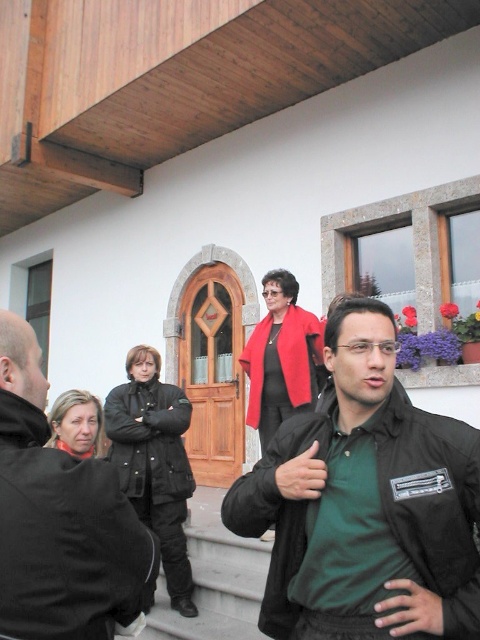
Question: Which object is closer to the camera taking this photo?

Choices:
 (A) dark green fabric jacket at lower right
 (B) matte red jacket at center
 (C) dark green textured jacket at center
 (D) black matte jacket at lower right

Answer: (A)

Question: Does black matte jacket at lower right appear over matte red jacket at center?

Choices:
 (A) yes
 (B) no

Answer: (B)

Question: Which point is closer to the camera taking this photo?

Choices:
 (A) (297, 371)
 (B) (180, 420)
 (C) (384, 490)
 (D) (25, 426)

Answer: (D)

Question: Can you confirm if black matte jacket at lower right is positioned to the left of matte red jacket at center?

Choices:
 (A) yes
 (B) no

Answer: (B)

Question: Is black matte jacket at lower right positioned behind dark green textured jacket at center?

Choices:
 (A) no
 (B) yes

Answer: (A)

Question: Which point is farther to the camera?

Choices:
 (A) dark green fabric jacket at lower right
 (B) matte red jacket at center
 (C) black matte jacket at lower right

Answer: (B)